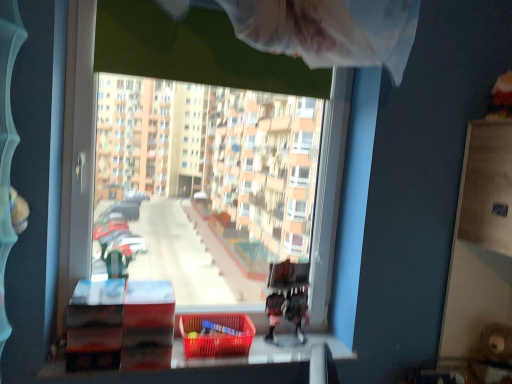
Question: Can we say wooden bunk bed at center lies outside transparent plastic window at center?

Choices:
 (A) no
 (B) yes

Answer: (A)

Question: Is wooden bunk bed at center smaller than transparent plastic window at center?

Choices:
 (A) yes
 (B) no

Answer: (A)

Question: Is wooden bunk bed at center positioned in front of transparent plastic window at center?

Choices:
 (A) no
 (B) yes

Answer: (A)

Question: Does wooden bunk bed at center appear on the right side of transparent plastic window at center?

Choices:
 (A) yes
 (B) no

Answer: (A)

Question: From a real-world perspective, is wooden bunk bed at center on top of transparent plastic window at center?

Choices:
 (A) yes
 (B) no

Answer: (B)

Question: Considering the positions of transparent plastic window at center and translucent plastic basket at lower center in the image, is transparent plastic window at center wider or thinner than translucent plastic basket at lower center?

Choices:
 (A) thin
 (B) wide

Answer: (A)

Question: Is transparent plastic window at center inside the boundaries of translucent plastic basket at lower center, or outside?

Choices:
 (A) outside
 (B) inside

Answer: (A)

Question: Is transparent plastic window at center in front of or behind translucent plastic basket at lower center in the image?

Choices:
 (A) front
 (B) behind

Answer: (A)

Question: From the image's perspective, is transparent plastic window at center above or below translucent plastic basket at lower center?

Choices:
 (A) below
 (B) above

Answer: (B)

Question: From the image's perspective, relative to transparent plastic window at center, is wooden bunk bed at center above or below?

Choices:
 (A) above
 (B) below

Answer: (B)

Question: In terms of size, does wooden bunk bed at center appear bigger or smaller than transparent plastic window at center?

Choices:
 (A) big
 (B) small

Answer: (B)

Question: Which is correct: wooden bunk bed at center is inside transparent plastic window at center, or outside of it?

Choices:
 (A) inside
 (B) outside

Answer: (A)

Question: Is wooden bunk bed at center to the left or to the right of transparent plastic window at center in the image?

Choices:
 (A) right
 (B) left

Answer: (A)

Question: Is transparent plastic window at center in front of or behind wooden bunk bed at center in the image?

Choices:
 (A) front
 (B) behind

Answer: (A)

Question: In terms of width, does transparent plastic window at center look wider or thinner when compared to wooden bunk bed at center?

Choices:
 (A) wide
 (B) thin

Answer: (A)